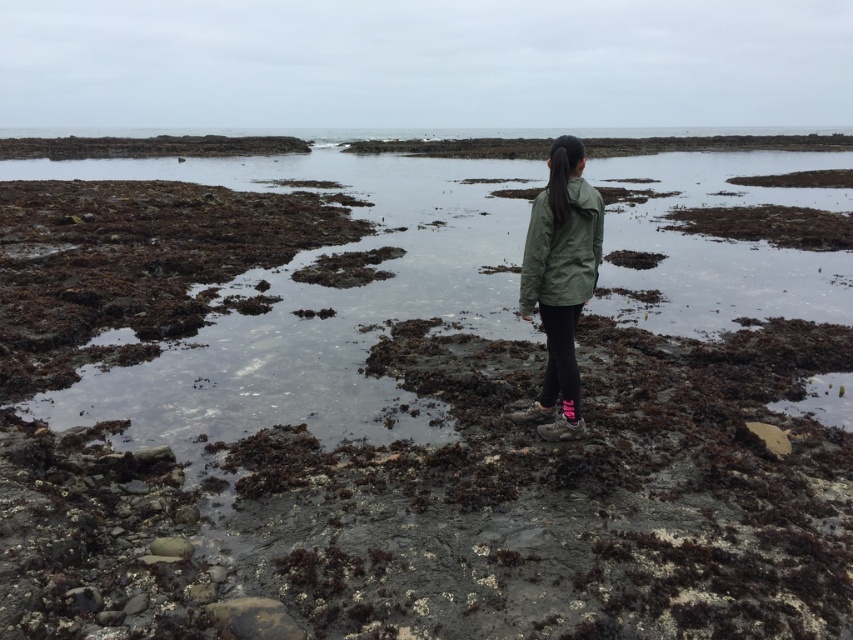
Question: Is green matte jacket at center smaller than olive green fabric jacket at center?

Choices:
 (A) no
 (B) yes

Answer: (A)

Question: Does green matte jacket at center have a larger size compared to olive green fabric jacket at center?

Choices:
 (A) no
 (B) yes

Answer: (B)

Question: Among these objects, which one is farthest from the camera?

Choices:
 (A) green matte jacket at center
 (B) olive green fabric jacket at center

Answer: (B)

Question: Considering the relative positions of green matte jacket at center and olive green fabric jacket at center in the image provided, where is green matte jacket at center located with respect to olive green fabric jacket at center?

Choices:
 (A) below
 (B) above

Answer: (B)